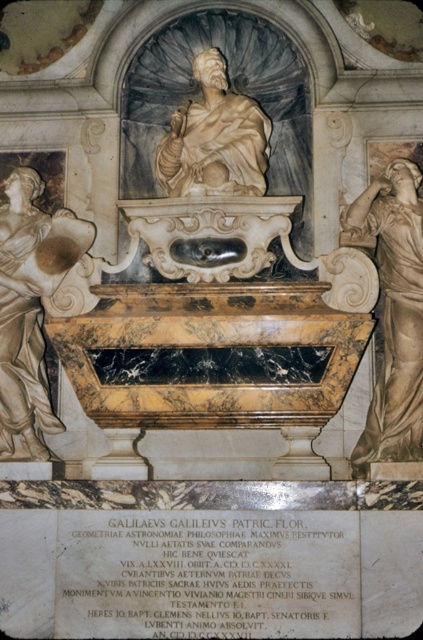
Question: Which point is closer to the camera?

Choices:
 (A) matte white statue at left
 (B) marble statue at center
 (C) matte gold statue at right

Answer: (C)

Question: Does matte white statue at left appear under marble statue at center?

Choices:
 (A) yes
 (B) no

Answer: (A)

Question: Among these points, which one is nearest to the camera?

Choices:
 (A) (211, 99)
 (B) (420, 200)
 (C) (14, 266)

Answer: (B)

Question: Observing the image, what is the correct spatial positioning of matte white statue at left in reference to matte gold statue at right?

Choices:
 (A) above
 (B) below

Answer: (A)

Question: Which point is closer to the camera?

Choices:
 (A) click(x=417, y=360)
 (B) click(x=25, y=374)

Answer: (A)

Question: Can you confirm if matte gold statue at right is bigger than marble statue at center?

Choices:
 (A) no
 (B) yes

Answer: (B)